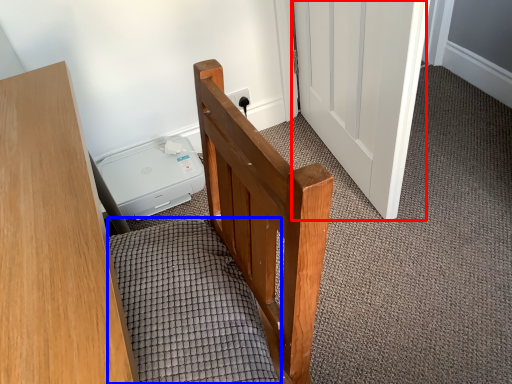
Question: Which point is closer to the camera, door (highlighted by a red box) or bedding (highlighted by a blue box)?

Choices:
 (A) door
 (B) bedding

Answer: (B)